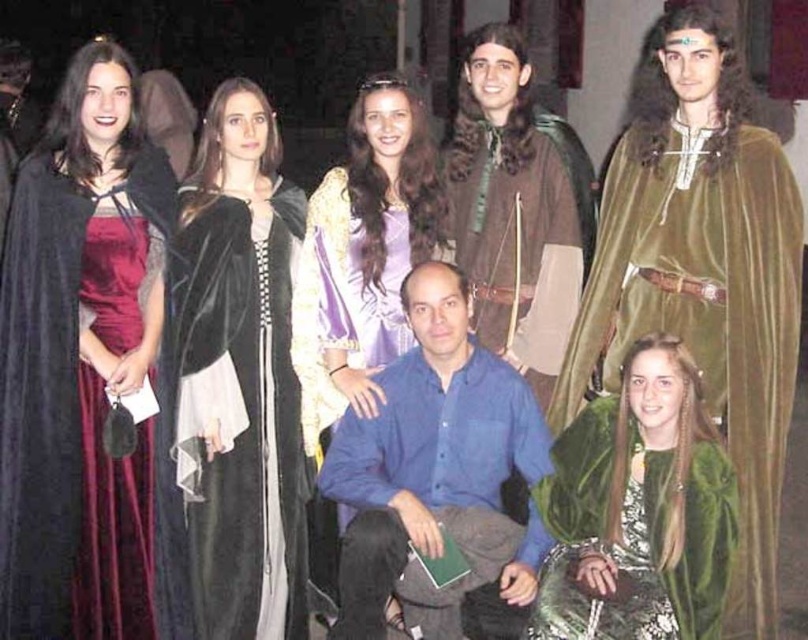
Question: Which point is farther to the camera?

Choices:
 (A) velvet burgundy dress at left
 (B) blue cotton shirt at center
 (C) purple satin dress at upper center

Answer: (C)

Question: Observing the image, what is the correct spatial positioning of velvet maroon dress at left in reference to brown leather jacket at center?

Choices:
 (A) right
 (B) left

Answer: (B)

Question: Does velvet black dress at center appear on the right side of brown leather jacket at center?

Choices:
 (A) no
 (B) yes

Answer: (A)

Question: Which of the following is the farthest from the observer?

Choices:
 (A) blue cotton shirt at center
 (B) green velvet cape at lower right

Answer: (A)

Question: Can you confirm if velvet black dress at center is thinner than purple satin dress at upper center?

Choices:
 (A) yes
 (B) no

Answer: (A)

Question: Which object is positioned closest to the blue cotton shirt at center?

Choices:
 (A) green velvet cape at lower right
 (B) brown leather jacket at center

Answer: (A)